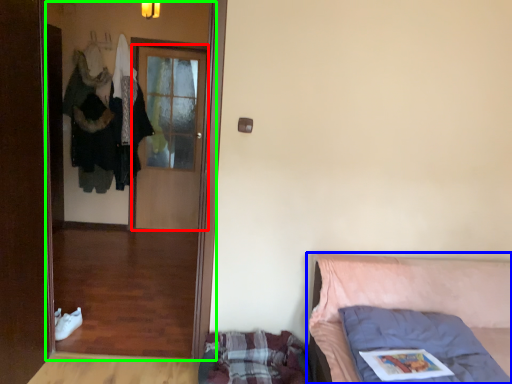
Question: Which is farther away from door (highlighted by a red box)? furniture (highlighted by a blue box) or screen door (highlighted by a green box)?

Choices:
 (A) furniture
 (B) screen door

Answer: (A)